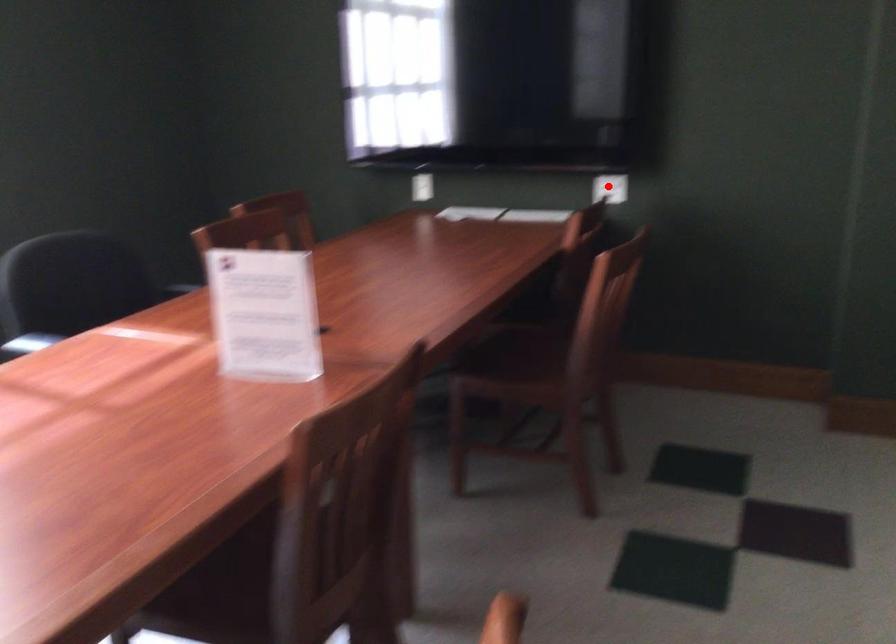
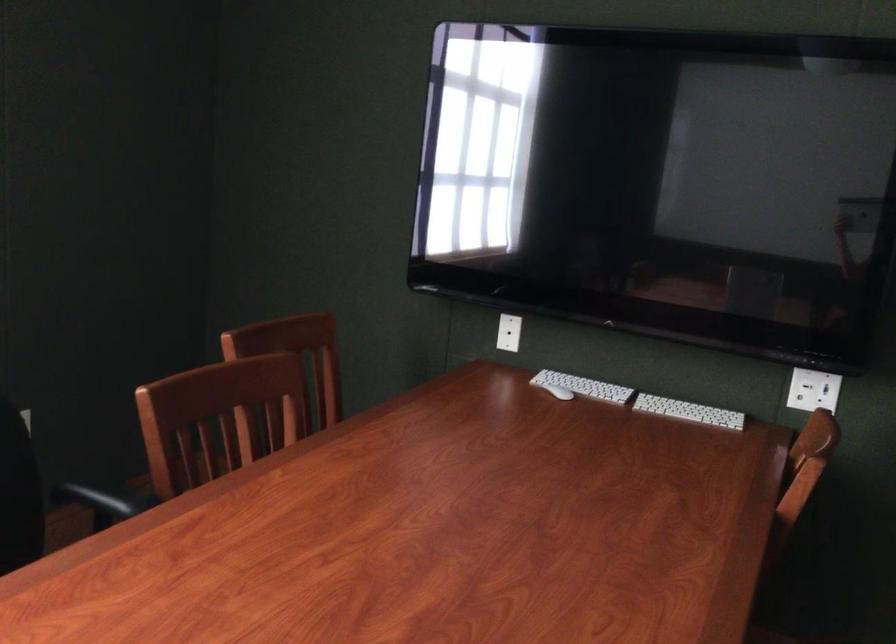
The point at the highlighted location is marked in the first image. Where is the corresponding point in the second image?

(813, 390)